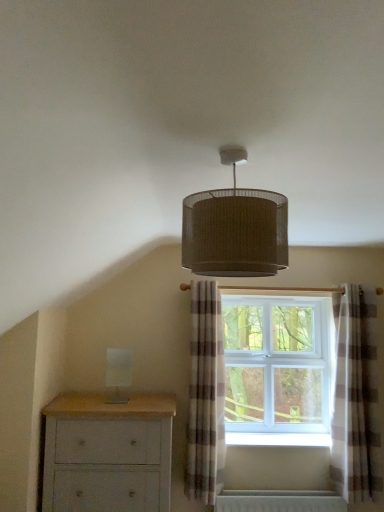
The height and width of the screenshot is (512, 384). I want to click on vacant area on top of light gray painted wood chest of drawers at lower left (from a real-world perspective), so tap(121, 400).